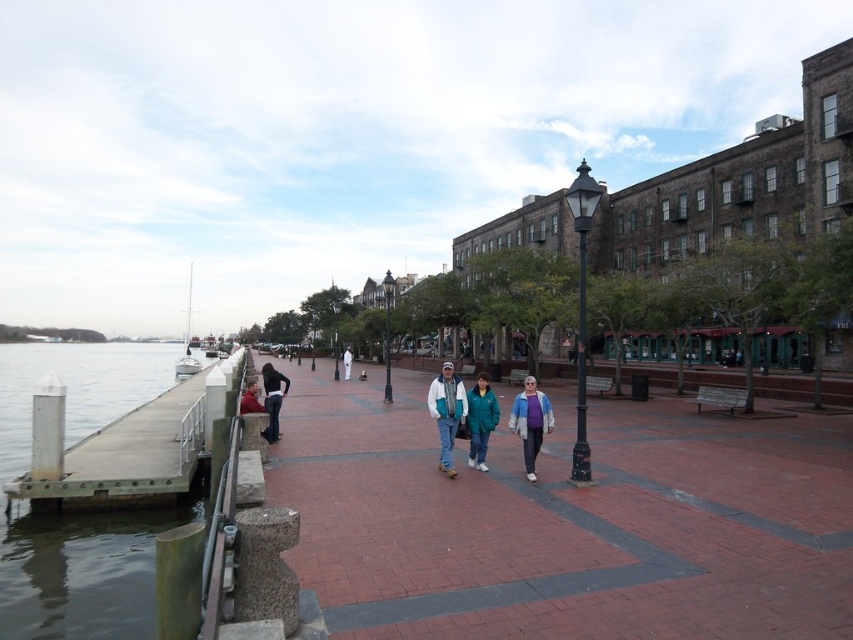
Question: Estimate the real-world distances between objects in this image. Which object is farther from the matte blue jacket at center?

Choices:
 (A) concrete dock at left
 (B) blue denim jacket at center
 (C) red knit cap at left
 (D) white cotton jacket at center

Answer: (A)

Question: Which object is the farthest from the white cotton jacket at center?

Choices:
 (A) black metal lamp post at center-right
 (B) brick pavement at center

Answer: (B)

Question: Does black metal lamp post at center-right have a larger size compared to matte blue jacket at center?

Choices:
 (A) no
 (B) yes

Answer: (B)

Question: Does denim pants at center have a larger size compared to black metal lamp post at center?

Choices:
 (A) yes
 (B) no

Answer: (B)

Question: Which point appears closest to the camera in this image?

Choices:
 (A) (335, 346)
 (B) (349, 365)
 (C) (531, 426)

Answer: (C)

Question: Does concrete dock at left come in front of black metal lamp post at center-right?

Choices:
 (A) no
 (B) yes

Answer: (B)